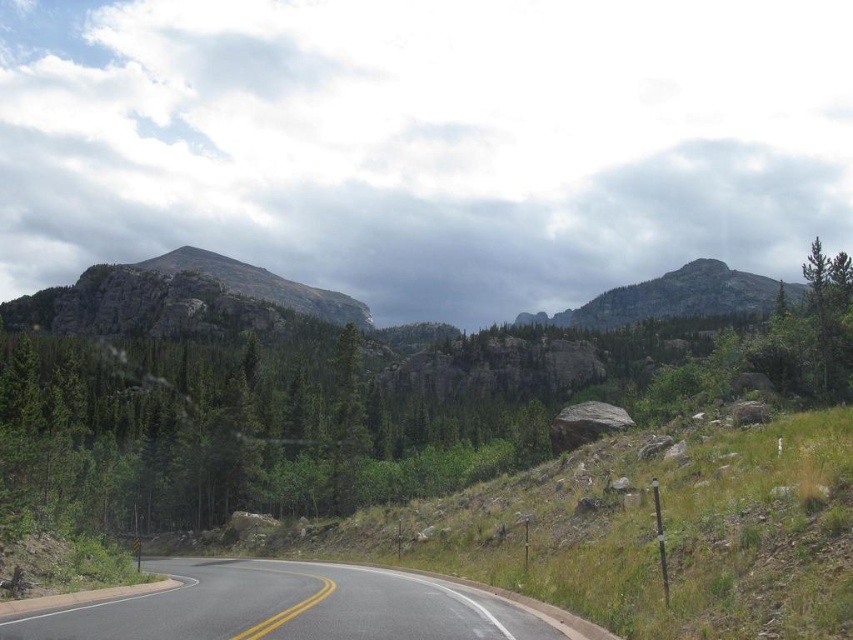
Between point (27, 621) and point (173, 317), which one is positioned in front?

Point (27, 621) is more forward.

Which is behind, point (390, 586) or point (68, 324)?

The point (68, 324) is more distant.

Find the location of `asphalt road at center`. asphalt road at center is located at coordinates (302, 605).

Is point (332, 600) closer to camera compared to point (625, 305)?

Yes, point (332, 600) is in front of point (625, 305).

Is asphalt road at center to the right of rugged granite mountain at upper right from the viewer's perspective?

Incorrect, asphalt road at center is not on the right side of rugged granite mountain at upper right.

Is point (485, 627) positioned after point (750, 308)?

That is False.

I want to click on asphalt road at center, so click(302, 605).

Is green matte tree at center positioned in front of rugged granite mountain at center?

Yes, green matte tree at center is in front of rugged granite mountain at center.

Describe the element at coordinates (231, 432) in the screenshot. I see `green matte tree at center` at that location.

Locate an element on the screen. green matte tree at center is located at coordinates (231, 432).